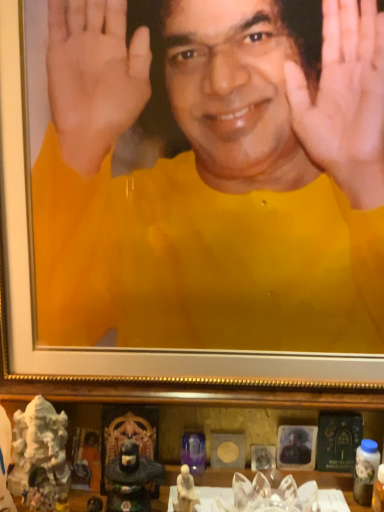
Question: Is matte black statue at lower center positioned with its back to white porcelain statue at lower center, the first toy viewed from the right?

Choices:
 (A) yes
 (B) no

Answer: (B)

Question: Is matte black statue at lower center to the left of white porcelain statue at lower center, placed as the second toy when sorted from left to right, from the viewer's perspective?

Choices:
 (A) yes
 (B) no

Answer: (A)

Question: Does matte black statue at lower center have a greater width compared to white porcelain statue at lower center, placed as the second toy when sorted from left to right?

Choices:
 (A) yes
 (B) no

Answer: (A)

Question: Could you tell me if matte black statue at lower center is facing white porcelain statue at lower center, the first toy viewed from the right?

Choices:
 (A) no
 (B) yes

Answer: (A)

Question: Is matte black statue at lower center shorter than white porcelain statue at lower center, placed as the second toy when sorted from left to right?

Choices:
 (A) yes
 (B) no

Answer: (B)

Question: Considering the relative positions of matte black statue at lower center and white porcelain statue at lower center, the first toy viewed from the right, in the image provided, is matte black statue at lower center to the right of white porcelain statue at lower center, the first toy viewed from the right, from the viewer's perspective?

Choices:
 (A) yes
 (B) no

Answer: (B)

Question: Is matte black statue at lower center outside of yellow matte shirt at center, which is the second man in right-to-left order?

Choices:
 (A) yes
 (B) no

Answer: (A)

Question: Is matte black statue at lower center shorter than yellow matte shirt at center, which is the second man in right-to-left order?

Choices:
 (A) no
 (B) yes

Answer: (B)

Question: Is matte black statue at lower center facing away from yellow matte shirt at center, the 1th man positioned from the top?

Choices:
 (A) yes
 (B) no

Answer: (B)

Question: Does matte black statue at lower center lie in front of yellow matte shirt at center, which is the second man in right-to-left order?

Choices:
 (A) no
 (B) yes

Answer: (A)

Question: Is matte black statue at lower center next to yellow matte shirt at center, which is the second man in right-to-left order, and touching it?

Choices:
 (A) no
 (B) yes

Answer: (A)

Question: From a real-world perspective, is matte black statue at lower center located beneath yellow matte shirt at center, which is the second man in right-to-left order?

Choices:
 (A) no
 (B) yes

Answer: (B)

Question: Is matte black statue at lower center not within matte black portrait at lower center, placed as the first man when sorted from right to left?

Choices:
 (A) yes
 (B) no

Answer: (A)